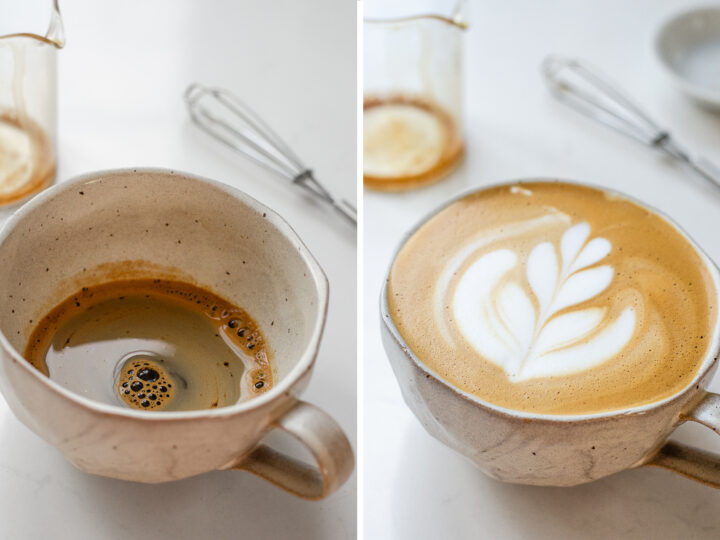
This screenshot has height=540, width=720. Find the location of `full mug`. full mug is located at coordinates (499, 453).